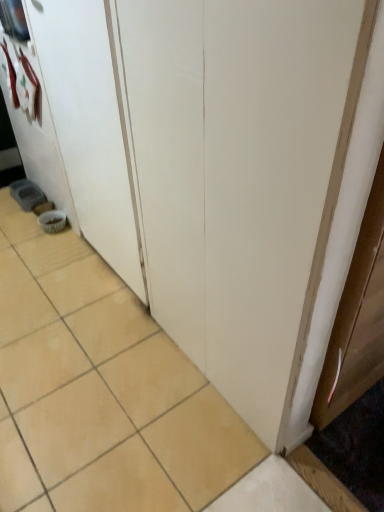
Question: Visually, is beige ceramic tile at lower left positioned to the left or to the right of white matte door at lower left?

Choices:
 (A) left
 (B) right

Answer: (A)

Question: Considering the positions of beige ceramic tile at lower left and white matte door at lower left in the image, is beige ceramic tile at lower left wider or thinner than white matte door at lower left?

Choices:
 (A) wide
 (B) thin

Answer: (A)

Question: Would you say beige ceramic tile at lower left is inside or outside white matte door at lower left?

Choices:
 (A) inside
 (B) outside

Answer: (B)

Question: Is point (92, 221) positioned closer to the camera than point (61, 460)?

Choices:
 (A) farther
 (B) closer

Answer: (A)

Question: Based on their sizes in the image, would you say white matte door at lower left is bigger or smaller than beige ceramic tile at lower left?

Choices:
 (A) big
 (B) small

Answer: (B)

Question: From the image's perspective, relative to beige ceramic tile at lower left, is white matte door at lower left above or below?

Choices:
 (A) below
 (B) above

Answer: (B)

Question: Would you say white matte door at lower left is to the left or to the right of beige ceramic tile at lower left in the picture?

Choices:
 (A) right
 (B) left

Answer: (A)